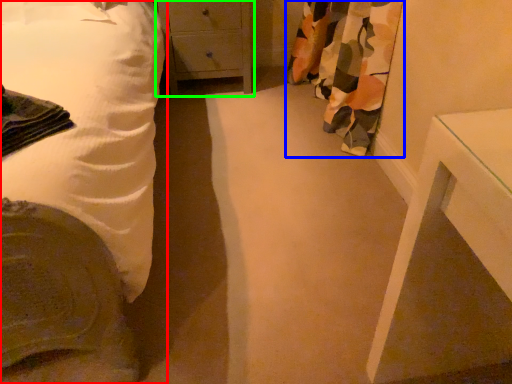
Question: Which is farther away from bed (highlighted by a red box)? curtain (highlighted by a blue box) or chest of drawers (highlighted by a green box)?

Choices:
 (A) curtain
 (B) chest of drawers

Answer: (A)